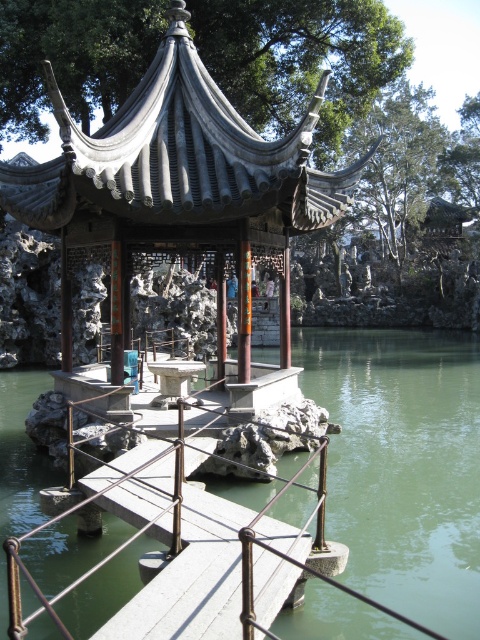
Does matte gray gazebo at center appear on the left side of metal/rustic bridge at center?

Indeed, matte gray gazebo at center is positioned on the left side of metal/rustic bridge at center.

Does matte gray gazebo at center have a greater height compared to metal/rustic bridge at center?

Yes, matte gray gazebo at center is taller than metal/rustic bridge at center.

Which is in front, point (237, 211) or point (213, 628)?

Point (213, 628)

Locate an element on the screen. Image resolution: width=480 pixels, height=640 pixels. matte gray gazebo at center is located at coordinates (178, 193).